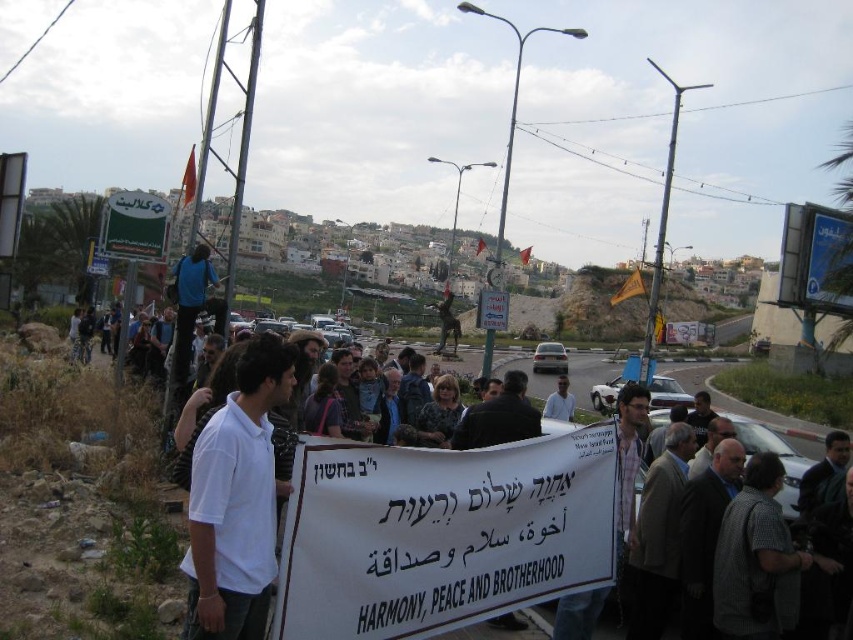
You are a photographer trying to capture a clear shot of the two people wearing the white cotton shirt at center and the white shirt at center. The camera you are using has a limited focus range. Which of the two shirts should you focus on first to ensure both are in focus, considering their sizes?

Since the white cotton shirt at center is narrower than the white shirt at center, you should focus on the wider white shirt at center first to ensure both are within the focus range.